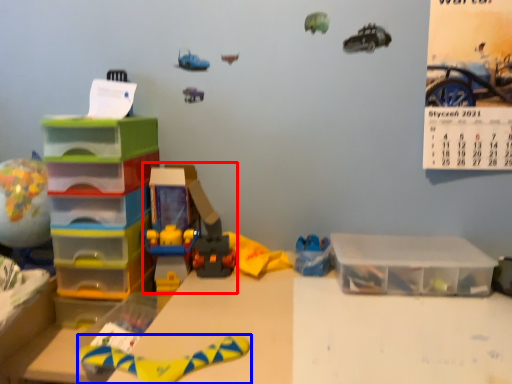
Question: Which point is further to the camera, toy (highlighted by a red box) or toy (highlighted by a blue box)?

Choices:
 (A) toy
 (B) toy

Answer: (A)